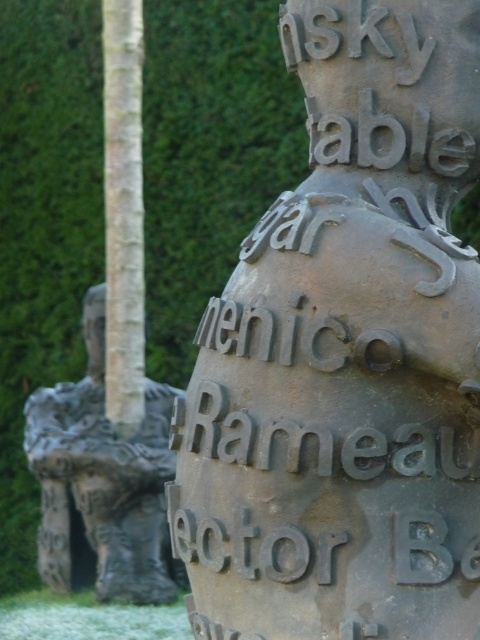
You are examining the metallic sculpture and notice two points marked on its surface at coordinates point (205, 458) and point (109, 440). From your perspective, which point appears closer to you?

Point (205, 458) is closer to the camera than point (109, 440).